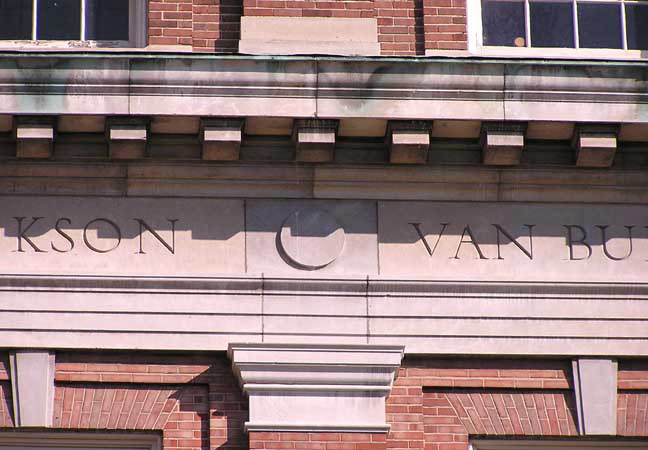
Locate an element on the screen. This screenshot has height=450, width=648. small pillar is located at coordinates (316, 377).